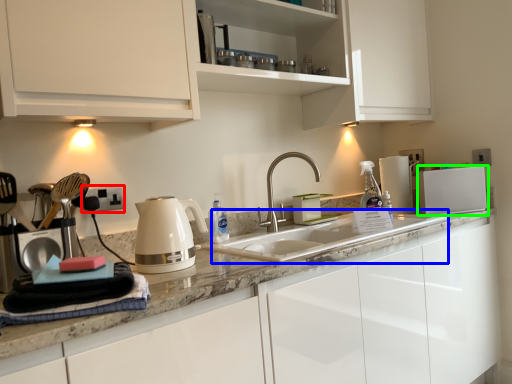
Question: Considering the real-world distances, which object is farthest from electric outlet (highlighted by a red box)? sink (highlighted by a blue box) or kitchen appliance (highlighted by a green box)?

Choices:
 (A) sink
 (B) kitchen appliance

Answer: (B)